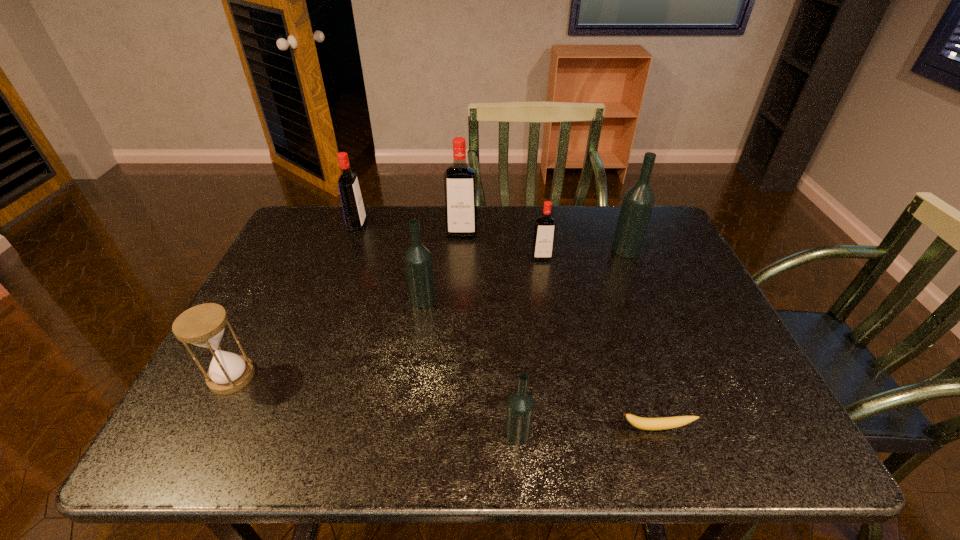
Find the location of a particular element. the fourth object from right to left is located at coordinates (520, 405).

The width and height of the screenshot is (960, 540). What are the coordinates of `the third vodka from right to left` in the screenshot? It's located at (520, 405).

At what (x,y) coordinates should I click in order to perform the action: click on the third nearest object. Please return your answer as a coordinate pair (x, y). The width and height of the screenshot is (960, 540). Looking at the image, I should click on (203, 325).

Find the location of a particular element. The height and width of the screenshot is (540, 960). hourglass is located at coordinates (203, 325).

Image resolution: width=960 pixels, height=540 pixels. In order to click on banana in this screenshot , I will do `click(649, 424)`.

The width and height of the screenshot is (960, 540). Find the location of `yellow banana`. yellow banana is located at coordinates (649, 424).

You are a GUI agent. You are given a task and a screenshot of the screen. Output one action in this format:
    pyautogui.click(x=<x>, y=<y>)
    Task: Click on the vacant area situated 0.270m on the front of the rightmost vodka
    The height and width of the screenshot is (540, 960).
    Given the screenshot: What is the action you would take?
    pyautogui.click(x=658, y=329)

Locate an element on the screen. The image size is (960, 540). free space located 0.210m on the front and back of the biggest red vodka is located at coordinates point(459,285).

You are a GUI agent. You are given a task and a screenshot of the screen. Output one action in this format:
    pyautogui.click(x=<x>, y=<y>)
    Task: Click on the vacant space situated 0.290m on the front and back of the second biggest red vodka
    
    Given the screenshot: What is the action you would take?
    pyautogui.click(x=458, y=225)

Find the location of a particular element. This screenshot has width=960, height=540. vacant space located 0.390m on the back of the second farthest black vodka is located at coordinates [x=435, y=211].